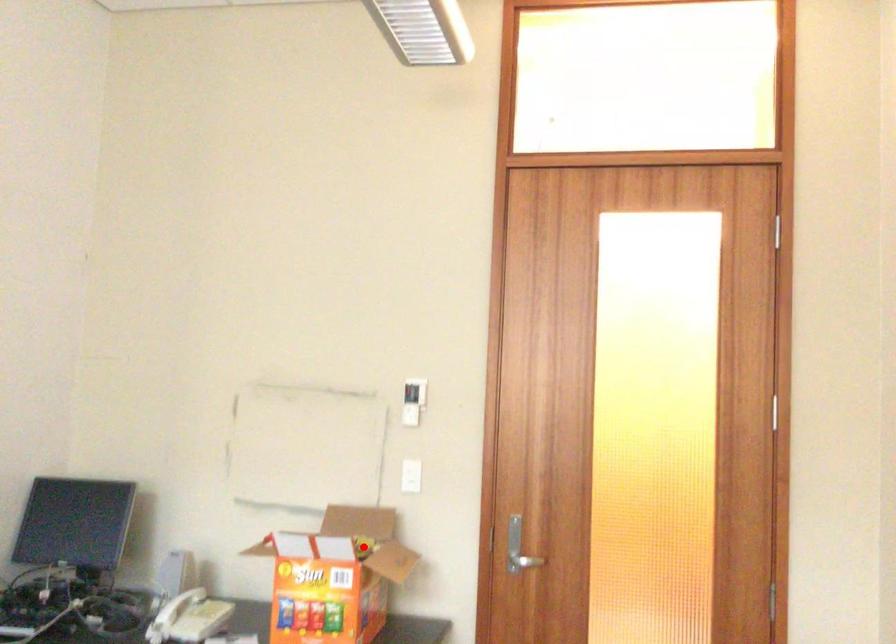
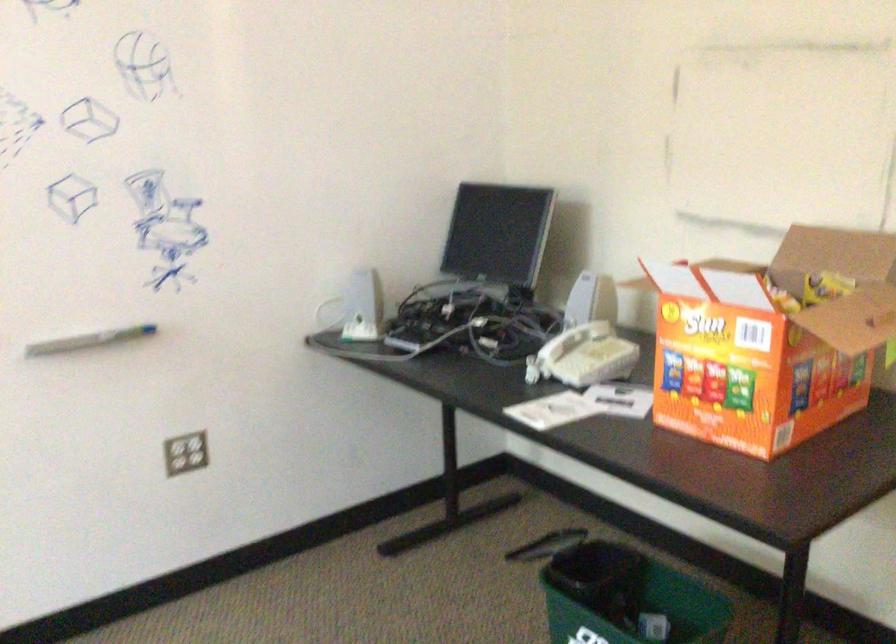
Locate, in the second image, the point that corresponds to the highlighted location in the first image.

(824, 287)